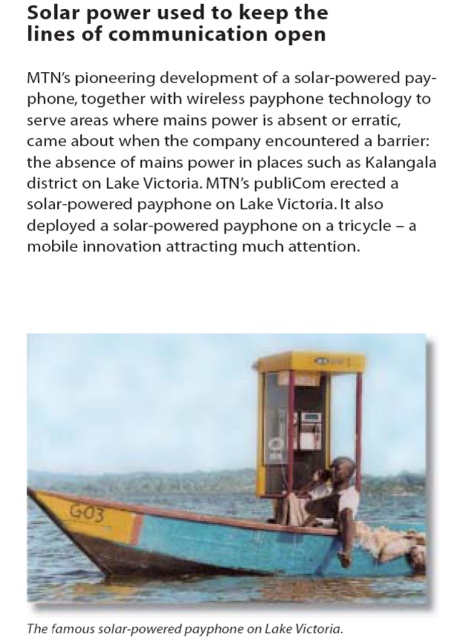
Question: Estimate the real-world distances between objects in this image. Which object is closer to the yellow plastic phone box at center?

Choices:
 (A) white matte shirt at center
 (B) yellow painted wood canoe at lower center
 (C) yellow painted wood boat at center

Answer: (A)

Question: Which point is farther from the camera taking this photo?

Choices:
 (A) (312, 435)
 (B) (366, 564)
 (C) (163, 515)

Answer: (A)

Question: Is yellow painted wood canoe at lower center smaller than yellow plastic phone box at center?

Choices:
 (A) no
 (B) yes

Answer: (A)

Question: Estimate the real-world distances between objects in this image. Which object is farther from the yellow painted wood canoe at lower center?

Choices:
 (A) white matte shirt at center
 (B) yellow painted wood boat at center

Answer: (B)

Question: Where is yellow painted wood canoe at lower center located in relation to yellow plastic phone box at center in the image?

Choices:
 (A) right
 (B) left

Answer: (B)

Question: Is yellow painted wood boat at center positioned before yellow painted wood canoe at lower center?

Choices:
 (A) no
 (B) yes

Answer: (A)